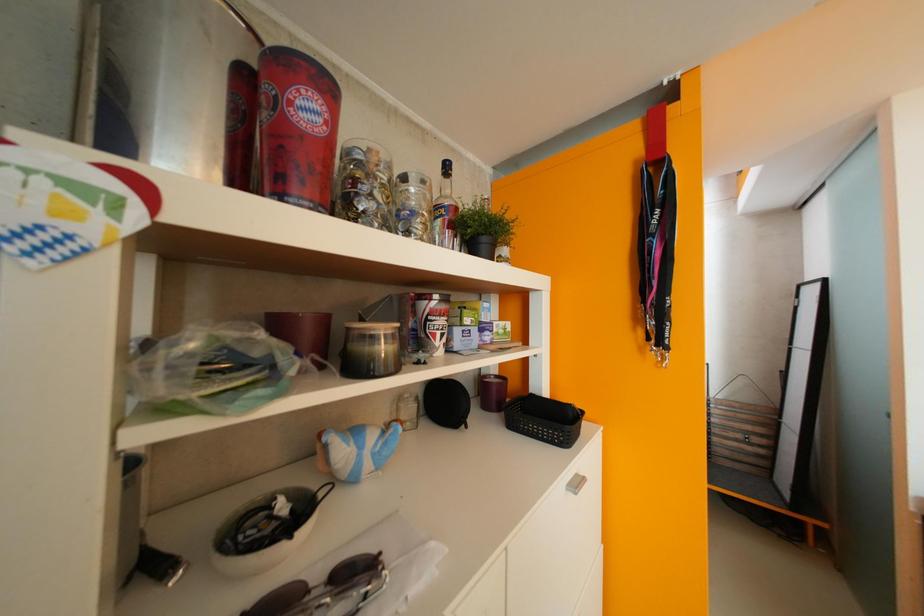
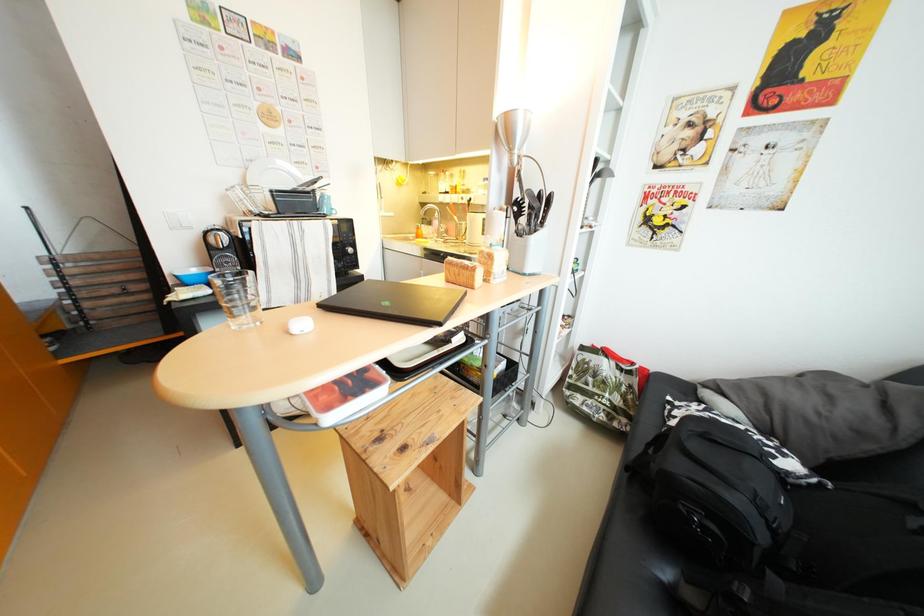
First-person continuous shooting, in which direction is the camera rotating?

The camera rotated toward right-down.